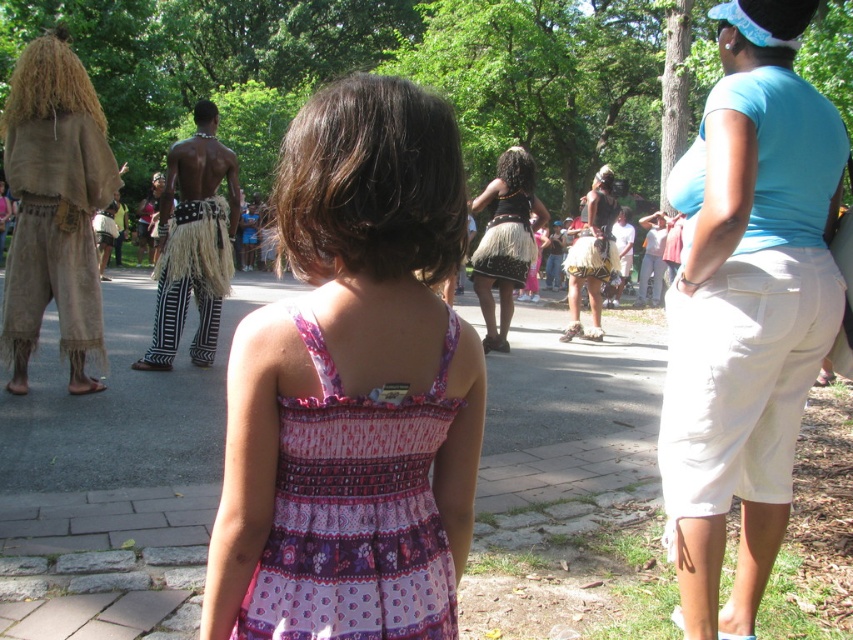
Question: Which point appears closest to the camera in this image?

Choices:
 (A) (270, 627)
 (B) (518, 227)
 (C) (792, 260)
 (D) (567, 292)

Answer: (A)

Question: Which object is closer to the camera taking this photo?

Choices:
 (A) pink printed dress at center
 (B) black grass skirt at center

Answer: (A)

Question: Is light blue cotton shirt at upper right positioned at the back of pink printed fabric dress at center?

Choices:
 (A) yes
 (B) no

Answer: (A)

Question: Is pink printed dress at center behind light blue cotton shirt at upper right?

Choices:
 (A) no
 (B) yes

Answer: (A)

Question: Is light blue cotton shirt at upper right in front of pink printed fabric dress at center?

Choices:
 (A) no
 (B) yes

Answer: (A)

Question: Among these points, which one is farthest from the camera?

Choices:
 (A) (456, 332)
 (B) (792, 308)
 (C) (86, 230)
 (D) (519, 221)

Answer: (D)